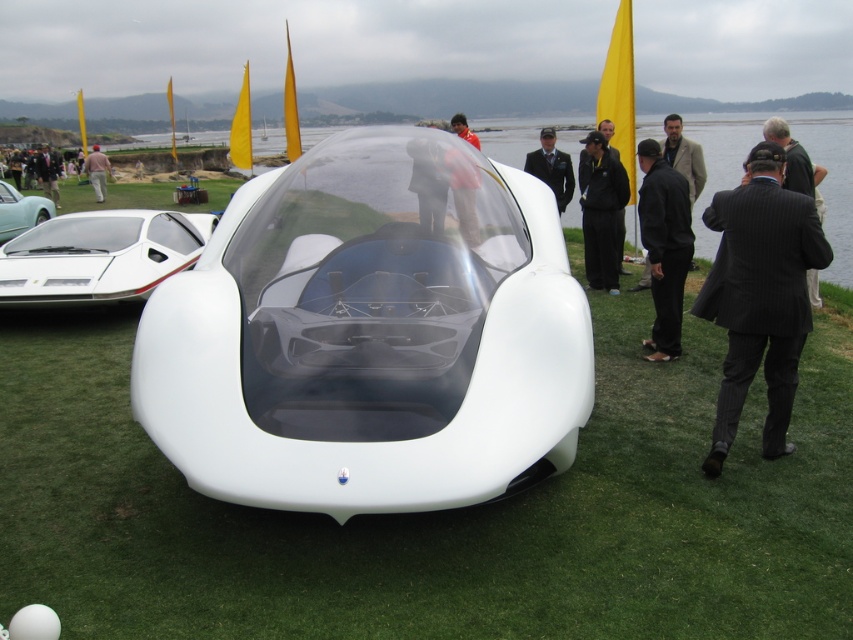
You are a photographer at a car exhibition. You want to capture a photo that emphasizes the height difference between the white matte concept car at center and the white glossy sports car at left. Which car should you position closer to the camera to make the height difference more apparent?

To emphasize the height difference between the white matte concept car at center and the white glossy sports car at left, position the white matte concept car at center closer to the camera since it is much taller than the white glossy sports car at left. This will make its height stand out more against the background.

Looking at this image, you are a photographer planning to take a photo of the white matte concept car at center and the white glossy sports car at left. You want to ensure both cars are fully visible in the frame. Based on their widths, which car should you position closer to the camera to achieve this?

The white matte concept car at center might be wider than white glossy sports car at left, so positioning the white matte concept car at center closer to the camera would help ensure it appears large enough in the frame while still fitting both cars within the shot.